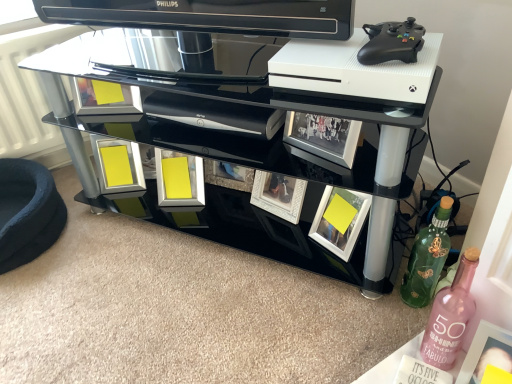
Question: Is yellow matte picture frame at lower right, the 2th picture frame when ordered from right to left, oriented towards yellow matte picture frame at lower right, which appears as the 5th picture frame when viewed from the left?

Choices:
 (A) no
 (B) yes

Answer: (A)

Question: Is yellow matte picture frame at lower right, which ranks as the second picture frame in front-to-back order, not close to yellow matte picture frame at lower right, marked as the 1th picture frame in a right-to-left arrangement?

Choices:
 (A) yes
 (B) no

Answer: (B)

Question: Would you say yellow matte picture frame at lower right, the 2th picture frame when ordered from right to left, is outside yellow matte picture frame at lower right, marked as the 1th picture frame in a right-to-left arrangement?

Choices:
 (A) no
 (B) yes

Answer: (B)

Question: Can you confirm if yellow matte picture frame at lower right, the 2th picture frame when ordered from right to left, is bigger than yellow matte picture frame at lower right, which is counted as the 1th picture frame, starting from the front?

Choices:
 (A) yes
 (B) no

Answer: (A)

Question: Is yellow matte picture frame at lower right, acting as the 5th picture frame starting from the back, inside yellow matte picture frame at lower right, the 2th picture frame when ordered from right to left?

Choices:
 (A) yes
 (B) no

Answer: (B)

Question: Is point (96, 84) closer or farther from the camera than point (474, 370)?

Choices:
 (A) closer
 (B) farther

Answer: (B)

Question: From the image's perspective, is metallic silver picture frame at center, which is the 4th picture frame from right to left, located above or below yellow matte picture frame at lower right, which is counted as the 1th picture frame, starting from the front?

Choices:
 (A) below
 (B) above

Answer: (B)

Question: Is metallic silver picture frame at center, which is the 4th picture frame from right to left, spatially inside yellow matte picture frame at lower right, which is counted as the 1th picture frame, starting from the front, or outside of it?

Choices:
 (A) outside
 (B) inside

Answer: (A)

Question: Considering their positions, is metallic silver picture frame at center, which is the 4th picture frame from right to left, located in front of or behind yellow matte picture frame at lower right, which appears as the 5th picture frame when viewed from the left?

Choices:
 (A) front
 (B) behind

Answer: (B)

Question: Based on their positions, is matte yellow picture frame at lower center, acting as the 3th picture frame starting from the right, located to the left or right of yellow matte picture frame at lower right, acting as the 5th picture frame starting from the back?

Choices:
 (A) left
 (B) right

Answer: (A)

Question: Looking at their shapes, would you say matte yellow picture frame at lower center, positioned as the 2th picture frame in back-to-front order, is wider or thinner than yellow matte picture frame at lower right, which is counted as the 1th picture frame, starting from the front?

Choices:
 (A) thin
 (B) wide

Answer: (B)

Question: From the image's perspective, relative to yellow matte picture frame at lower right, which is counted as the 1th picture frame, starting from the front, is matte yellow picture frame at lower center, acting as the 3th picture frame starting from the left, above or below?

Choices:
 (A) above
 (B) below

Answer: (A)

Question: In terms of height, does matte yellow picture frame at lower center, acting as the 3th picture frame starting from the left, look taller or shorter compared to yellow matte picture frame at lower right, marked as the 1th picture frame in a right-to-left arrangement?

Choices:
 (A) tall
 (B) short

Answer: (A)

Question: From the image's perspective, is green matte bottle at lower right, acting as the second bottle starting from the front, above or below metallic silver picture frame at center, which is counted as the third picture frame, starting from the back?

Choices:
 (A) below
 (B) above

Answer: (A)

Question: Considering the positions of green matte bottle at lower right, the first bottle viewed from the back, and metallic silver picture frame at center, which is the 4th picture frame from right to left, in the image, is green matte bottle at lower right, the first bottle viewed from the back, wider or thinner than metallic silver picture frame at center, which is the 4th picture frame from right to left,?

Choices:
 (A) wide
 (B) thin

Answer: (A)